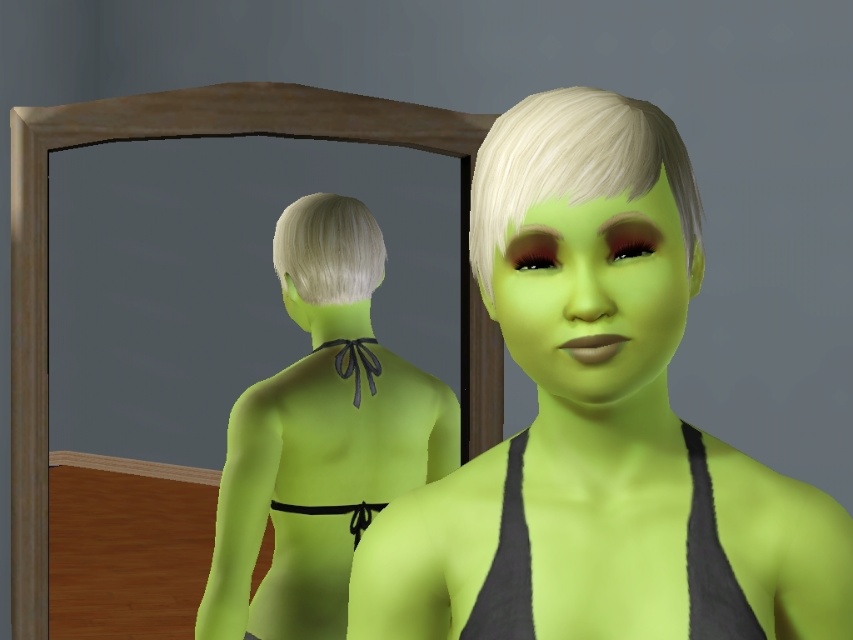
Question: Can you confirm if lime matte skin at center is positioned below lime matte/black halter top at center?

Choices:
 (A) no
 (B) yes

Answer: (A)

Question: Is lime matte skin at center positioned at the back of blonde silky hair at back?

Choices:
 (A) no
 (B) yes

Answer: (A)

Question: Which point is closer to the camera taking this photo?

Choices:
 (A) (589, 177)
 (B) (350, 470)
 (C) (310, 284)

Answer: (A)

Question: Which of these objects is positioned closest to the lime matte skin at center?

Choices:
 (A) blonde matte hair at upper center
 (B) blonde silky hair at back
 (C) lime matte/black halter top at center

Answer: (A)

Question: Which of the following is the closest to the observer?

Choices:
 (A) lime matte/black halter top at center
 (B) lime matte skin at center

Answer: (B)

Question: Considering the relative positions of lime matte skin at center and lime matte/black halter top at center in the image provided, where is lime matte skin at center located with respect to lime matte/black halter top at center?

Choices:
 (A) above
 (B) below

Answer: (A)